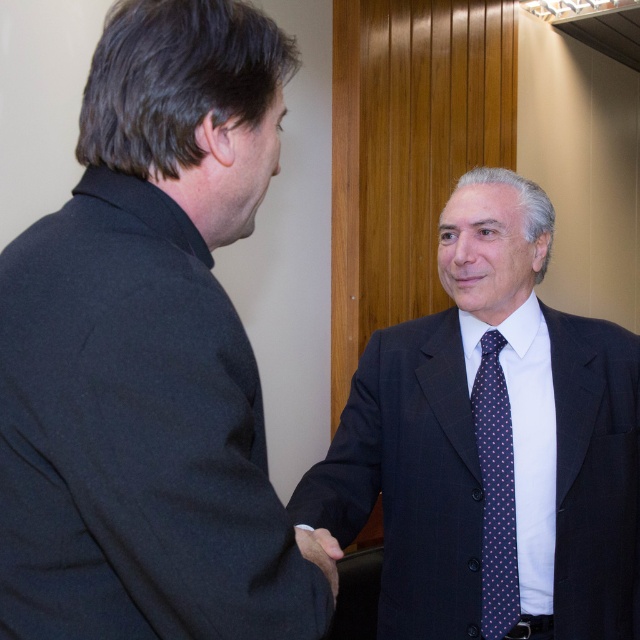
You are an event photographer who needs to capture a clear photo of the dark blue dotted tie at right and the dark brown leather hand at center. Since the lighting is soft, you want to ensure both subjects are well lit. Which object should you adjust the camera focus on first to ensure proper exposure, considering their position relative to the light source?

The dark blue dotted tie at right is located above the dark brown leather hand at center. Since it is higher up, it might be closer to the overhead light source, so adjusting focus on the dark blue dotted tie at right first would help ensure proper exposure.

What are the coordinates of the black wool suit at left in the image?

The coordinates of the black wool suit at left are at point (148, 353).

You are a photographer trying to capture the dark blue dotted tie at right in the image. The camera you are using has a focus point at coordinate point (496, 492). Can you confirm if this focus point is correctly positioned to capture the dark blue dotted tie at right?

Yes, the focus point at coordinate point (496, 492) is correctly positioned to capture the dark blue dotted tie at right as it directly indicates its location.